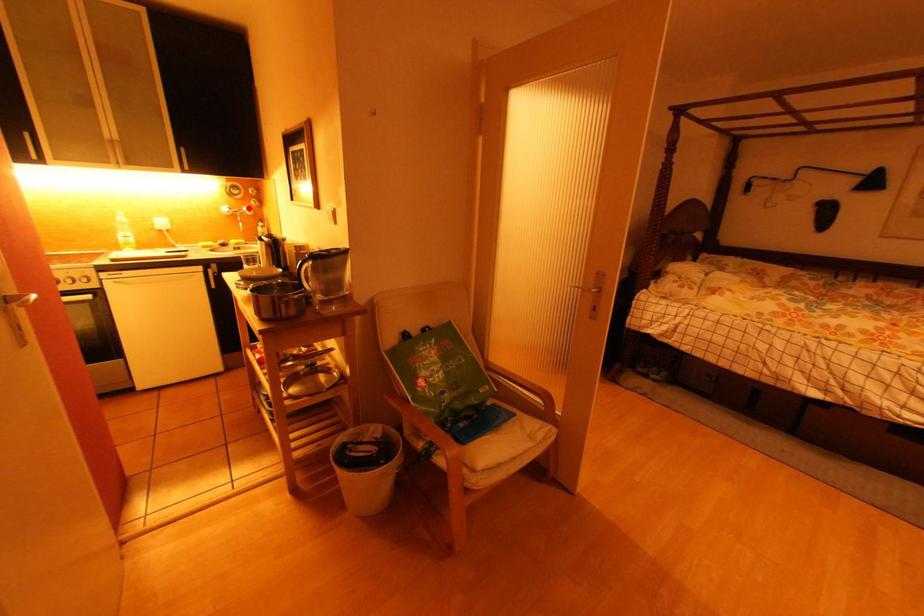
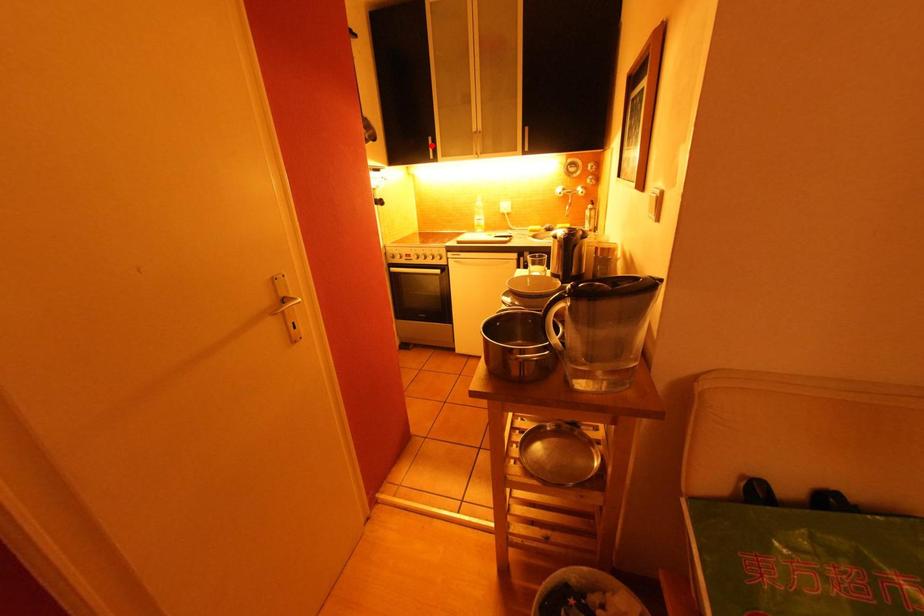
I am providing you with two images of the same scene from different viewpoints. A red point is marked on the first image and another point is marked on the second image. Is the marked point in image1 the same physical position as the marked point in image2?

No